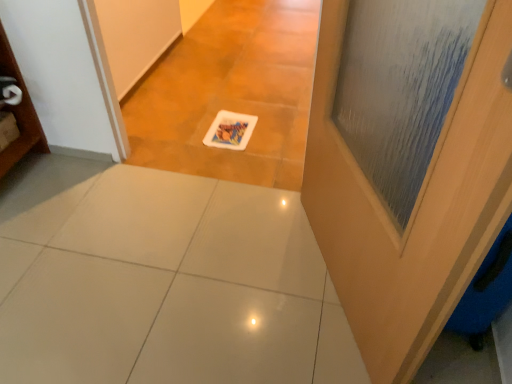
Identify the location of free region under wooden door at right (from a real-world perspective). (328, 288).